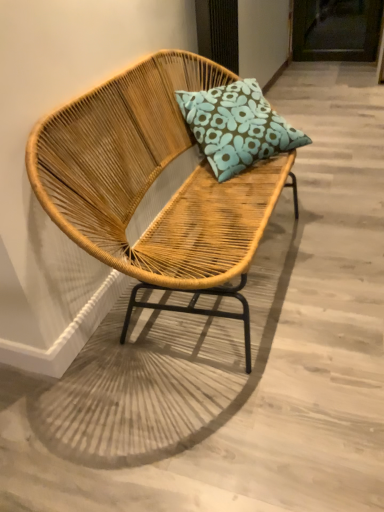
Locate an element on the screen. vacant area situated below bamboo woven chair at center (from a real-world perspective) is located at coordinates (216, 317).